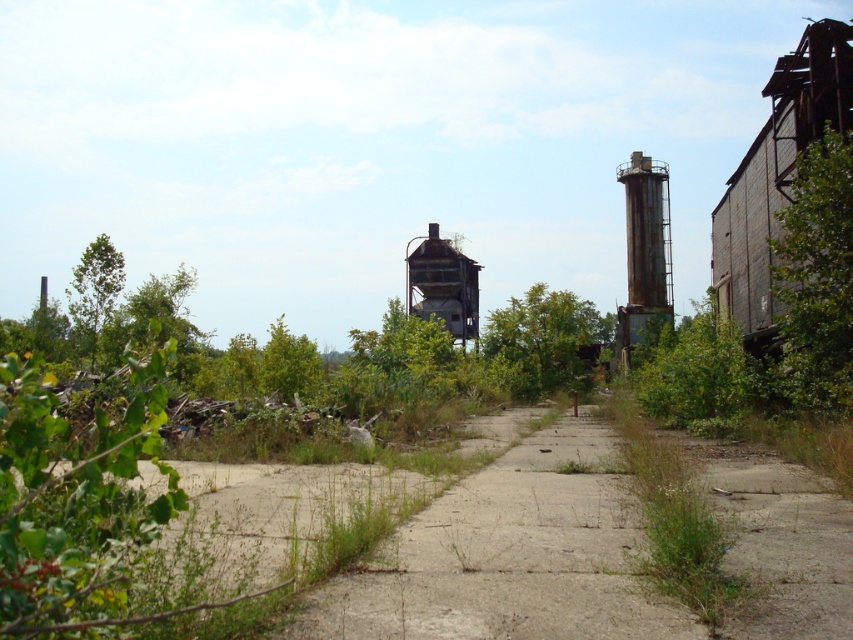
Who is positioned more to the left, green leafy tree at center or rusty metal water tower at center?

rusty metal water tower at center is more to the left.

The image size is (853, 640). Describe the element at coordinates (543, 340) in the screenshot. I see `green leafy tree at center` at that location.

Between point (601, 324) and point (431, 288), which one is positioned behind?

The point (601, 324) is behind.

Image resolution: width=853 pixels, height=640 pixels. I want to click on green leafy tree at center, so click(x=543, y=340).

Is dull concrete path at center smaller than green leafy tree at center?

Yes.

Does point (547, 541) come in front of point (548, 308)?

That is True.

What are the coordinates of `dull concrete path at center` in the screenshot? It's located at (509, 556).

Is dull concrete path at center positioned before rusty metal water tower at right?

Yes.

How much distance is there between dull concrete path at center and rusty metal water tower at right?

A distance of 57.27 meters exists between dull concrete path at center and rusty metal water tower at right.

Is point (482, 548) positioned after point (646, 296)?

No, it is not.

Where is `dull concrete path at center`? This screenshot has height=640, width=853. dull concrete path at center is located at coordinates click(x=509, y=556).